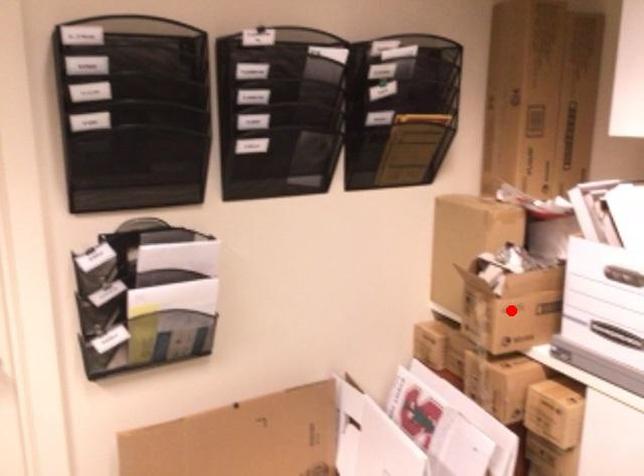
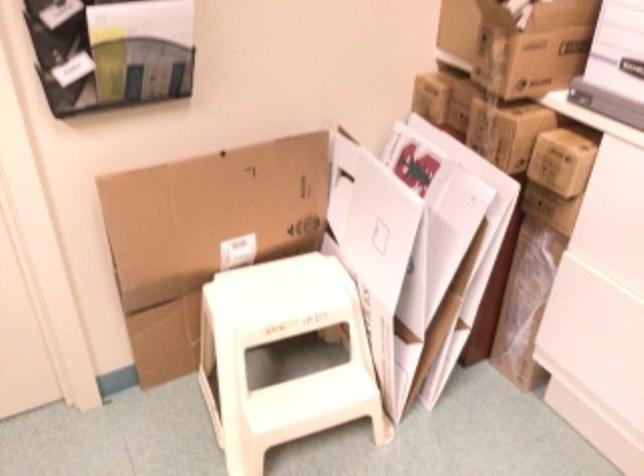
Question: I am providing you with two images of the same scene from different viewpoints. A red point is shown in image1. For the corresponding object point in image2, is it positioned nearer or farther from the camera?

Choices:
 (A) Nearer
 (B) Farther

Answer: (A)